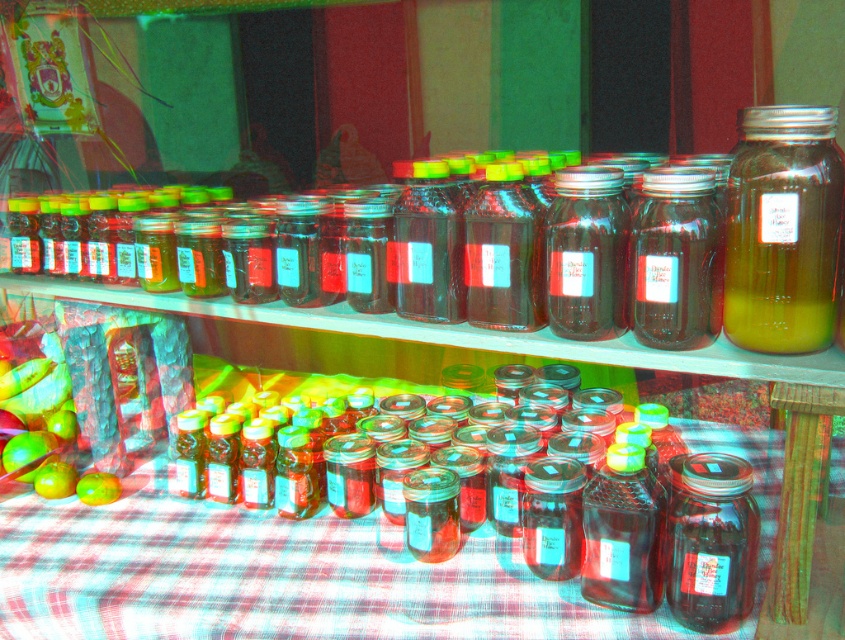
You are standing in front of a display of jars filled with honey. You need to locate the transparent glass jars at center. Where are they positioned in terms of coordinates?

The transparent glass jars at center are located at coordinates point (341, 580).

You are arranging items on a shelf and need to place both the transparent glass jars at center and the green matte apple at lower left. According to the image, which item should be placed to the left of the other?

The transparent glass jars at center should be placed to the right of the green matte apple at lower left, as the transparent glass jars at center is positioned on the right side of green matte apple at lower left in the image.

You are a beekeeper trying to place a new jar of honey between the clear glass jar at right and the transparent glass jar at lower right. The new jar is 5 inches wide. Can you fit it between them without moving the existing jars?

The distance between the clear glass jar at right and the transparent glass jar at lower right is 10.93 inches. Since the new jar is only 5 inches wide, there is enough space to fit it between them without moving the existing jars.